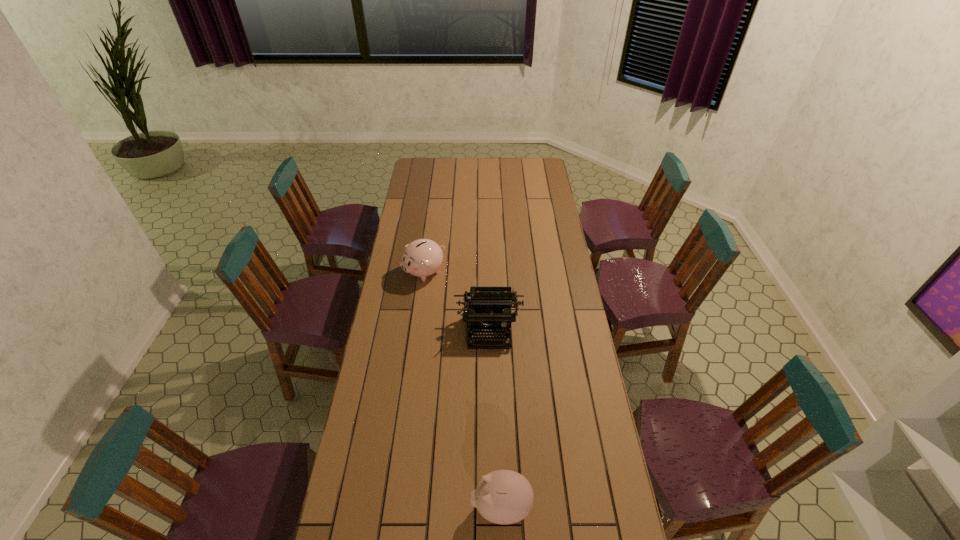
Where is `the leftmost object`? the leftmost object is located at coordinates (423, 257).

Find the location of a particular element. The height and width of the screenshot is (540, 960). the left piggy bank is located at coordinates (423, 257).

The width and height of the screenshot is (960, 540). What are the coordinates of `typewriter` in the screenshot? It's located at (492, 304).

Where is `the shorter piggy bank`? The width and height of the screenshot is (960, 540). the shorter piggy bank is located at coordinates (504, 497).

Find the location of a particular element. the right piggy bank is located at coordinates pyautogui.click(x=504, y=497).

This screenshot has height=540, width=960. I want to click on free space located 0.210m on the front of the farther piggy bank, so click(x=418, y=322).

Locate an element on the screen. Image resolution: width=960 pixels, height=540 pixels. free space located on the keyboard of the typewriter is located at coordinates (490, 389).

You are a GUI agent. You are given a task and a screenshot of the screen. Output one action in this format:
    pyautogui.click(x=<x>, y=<y>)
    Task: Click on the free spot located 0.370m at the snout of the nearer piggy bank
    
    Given the screenshot: What is the action you would take?
    pyautogui.click(x=347, y=507)

Locate an element on the screen. free location located at the snout of the nearer piggy bank is located at coordinates (360, 507).

What are the coordinates of `blank area located 0.390m at the snout of the nearer piggy bank` in the screenshot? It's located at (340, 507).